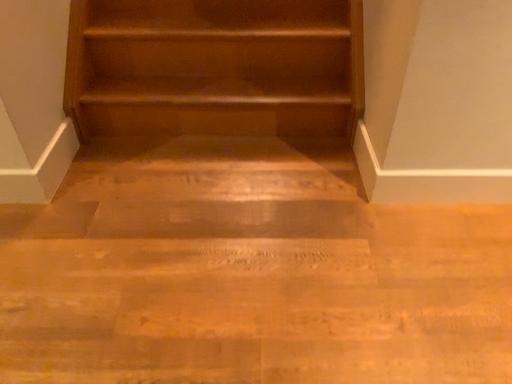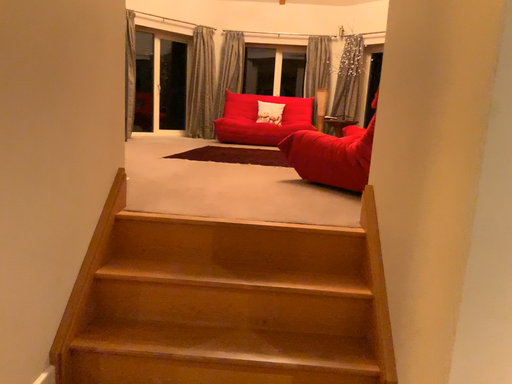
Question: How did the camera likely rotate when shooting the video?

Choices:
 (A) rotated downward
 (B) rotated upward

Answer: (B)